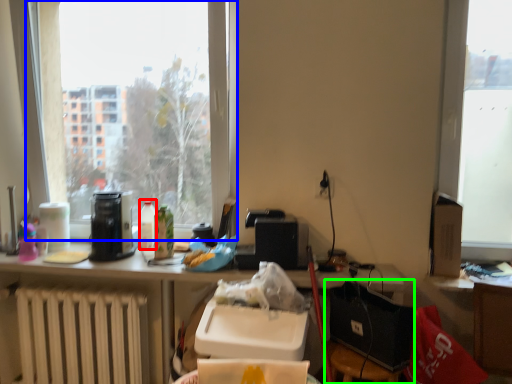
Question: Estimate the real-world distances between objects in this image. Which object is closer to bottle (highlighted by a red box), window (highlighted by a blue box) or chair (highlighted by a green box)?

Choices:
 (A) window
 (B) chair

Answer: (B)